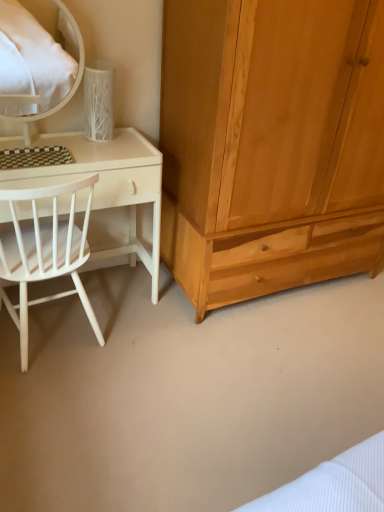
Identify the location of vacant space to the right of white glossy mirror at upper left. (110, 150).